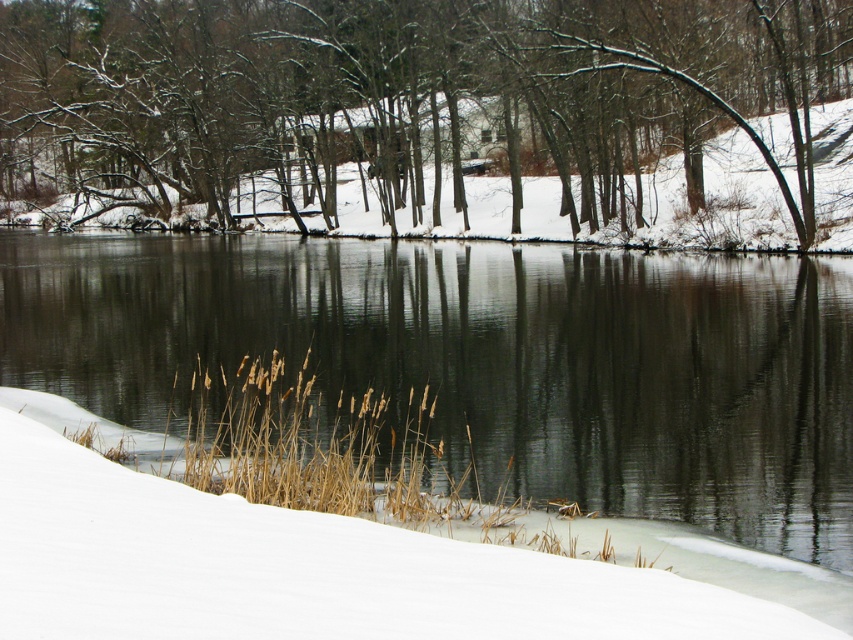
Question: Can you confirm if snow-covered tree at center is positioned to the left of white fluffy snow at lower center?

Choices:
 (A) no
 (B) yes

Answer: (B)

Question: Observing the image, what is the correct spatial positioning of snow-covered tree at center in reference to white fluffy snow at lower center?

Choices:
 (A) right
 (B) left

Answer: (B)

Question: Among these objects, which one is farthest from the camera?

Choices:
 (A) white fluffy snow at lower center
 (B) clear water at center

Answer: (B)

Question: Does snow-covered tree at center have a smaller size compared to white fluffy snow at lower center?

Choices:
 (A) yes
 (B) no

Answer: (B)

Question: Which of the following is the farthest from the observer?

Choices:
 (A) (399, 35)
 (B) (471, 387)

Answer: (A)

Question: Which point is farther to the camera?

Choices:
 (A) (213, 532)
 (B) (751, 99)

Answer: (B)